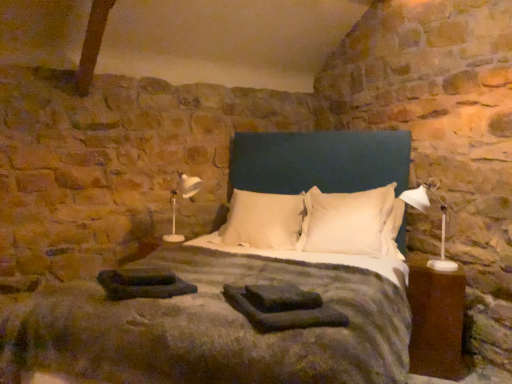
Question: Considering the relative sizes of brown wood nightstand at right and dark gray fabric at center, arranged as the 1th material when viewed from the right, in the image provided, is brown wood nightstand at right taller than dark gray fabric at center, arranged as the 1th material when viewed from the right,?

Choices:
 (A) yes
 (B) no

Answer: (A)

Question: Is brown wood nightstand at right positioned far away from dark gray fabric at center, the 2th material viewed from the left?

Choices:
 (A) no
 (B) yes

Answer: (B)

Question: Can you confirm if brown wood nightstand at right is bigger than dark gray fabric at center, the 2th material viewed from the left?

Choices:
 (A) yes
 (B) no

Answer: (A)

Question: Is brown wood nightstand at right facing towards dark gray fabric at center, the 2th material viewed from the left?

Choices:
 (A) no
 (B) yes

Answer: (A)

Question: Does brown wood nightstand at right have a smaller size compared to dark gray fabric at center, arranged as the 1th material when viewed from the right?

Choices:
 (A) no
 (B) yes

Answer: (A)

Question: Is white plastic table lamp at right, which is the 2th table lamp in back-to-front order, in front of or behind velvet blue bed at center in the image?

Choices:
 (A) behind
 (B) front

Answer: (A)

Question: From a real-world perspective, is white plastic table lamp at right, the second table lamp when ordered from left to right, above or below velvet blue bed at center?

Choices:
 (A) above
 (B) below

Answer: (A)

Question: Would you say white plastic table lamp at right, which is the 2th table lamp in back-to-front order, is inside or outside velvet blue bed at center?

Choices:
 (A) outside
 (B) inside

Answer: (B)

Question: Considering the positions of white plastic table lamp at right, the second table lamp when ordered from left to right, and velvet blue bed at center in the image, is white plastic table lamp at right, the second table lamp when ordered from left to right, wider or thinner than velvet blue bed at center?

Choices:
 (A) thin
 (B) wide

Answer: (A)

Question: Is white soft pillow at center, which is counted as the 1th pillow, starting from the right, inside the boundaries of white soft pillow at center, which appears as the 1th pillow when viewed from the left, or outside?

Choices:
 (A) outside
 (B) inside

Answer: (A)

Question: In terms of width, does white soft pillow at center, the second pillow in the left-to-right sequence, look wider or thinner when compared to white soft pillow at center, which is the second pillow from right to left?

Choices:
 (A) thin
 (B) wide

Answer: (A)

Question: Visually, is white soft pillow at center, the second pillow in the left-to-right sequence, positioned to the left or to the right of white soft pillow at center, which appears as the 1th pillow when viewed from the left?

Choices:
 (A) left
 (B) right

Answer: (B)

Question: Considering their positions, is white soft pillow at center, the second pillow in the left-to-right sequence, located in front of or behind white soft pillow at center, which appears as the 1th pillow when viewed from the left?

Choices:
 (A) front
 (B) behind

Answer: (A)

Question: Based on their positions, is black fabric at lower left, placed as the 2th material when sorted from right to left, located to the left or right of white plastic table lamp at left, acting as the first table lamp starting from the left?

Choices:
 (A) right
 (B) left

Answer: (A)

Question: Is black fabric at lower left, the 1th material when ordered from left to right, inside or outside of white plastic table lamp at left, the 2th table lamp from the front?

Choices:
 (A) outside
 (B) inside

Answer: (A)